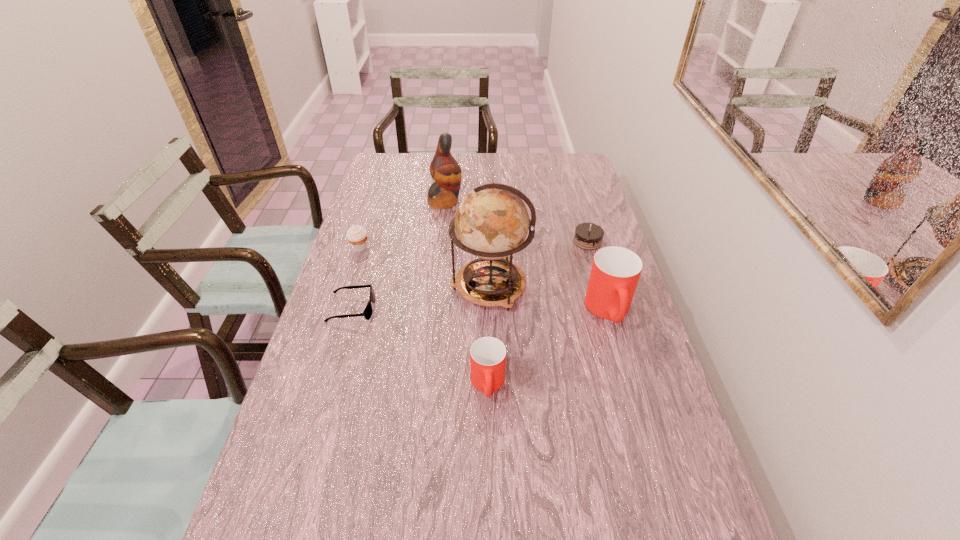
Locate an element on the screen. Image resolution: width=960 pixels, height=540 pixels. free spot between the tallest object and the shortest object is located at coordinates (420, 298).

Locate an element on the screen. blank region between the shortest object and the farther cup is located at coordinates (480, 309).

You are a GUI agent. You are given a task and a screenshot of the screen. Output one action in this format:
    pyautogui.click(x=<x>, y=<y>)
    Task: Click on the free space between the shortest object and the fifth tallest object
    The height and width of the screenshot is (540, 960).
    Given the screenshot: What is the action you would take?
    pyautogui.click(x=356, y=278)

Find the location of a particular element. Image resolution: width=960 pixels, height=540 pixels. empty space between the fifth tallest object and the shortest object is located at coordinates (356, 278).

The height and width of the screenshot is (540, 960). Identify the location of object that is the second closest one to the nearest object. (615, 272).

Identify which object is the third closest to the tallest object. Please provide its 2D coordinates. Your answer should be formatted as a tuple, i.e. [(x, y)], where the tuple contains the x and y coordinates of a point satisfying the conditions above.

[(588, 236)]

You are a GUI agent. You are given a task and a screenshot of the screen. Output one action in this format:
    pyautogui.click(x=<x>, y=<y>)
    Task: Click on the free spot that satisfies the following two spatial constraints: 1. at the center of the tallest object; 2. on the side of the nearest object with the handle
    This screenshot has height=540, width=960.
    Given the screenshot: What is the action you would take?
    pyautogui.click(x=492, y=384)

The width and height of the screenshot is (960, 540). Identify the location of vacant position in the image that satisfies the following two spatial constraints: 1. on the face of the farthest object; 2. on the right side of the chocolate cake. pyautogui.click(x=441, y=241).

Image resolution: width=960 pixels, height=540 pixels. In order to click on vacant point that satisfies the following two spatial constraints: 1. on the face of the sixth tallest object; 2. on the left side of the farthest object in this screenshot , I will do `click(441, 241)`.